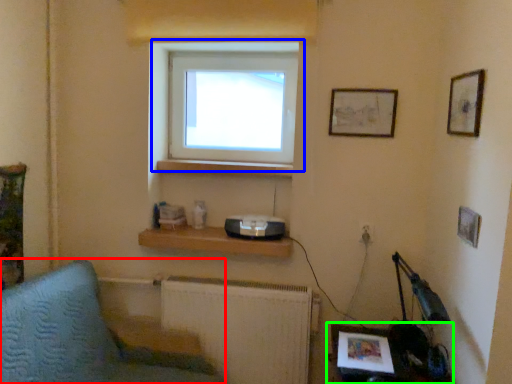
Question: Which object is the farthest from furniture (highlighted by a red box)? Choose among these: window (highlighted by a blue box) or table (highlighted by a green box).

Choices:
 (A) window
 (B) table

Answer: (B)